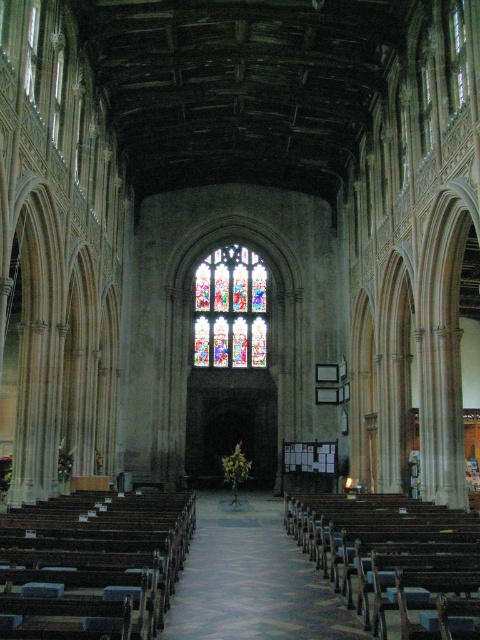
Between point (305, 548) and point (208, 508), which one is positioned behind?

The point (208, 508) is more distant.

In the scene shown: Does wooden polished bench at center appear on the right side of wooden polished pews at center?

Correct, you'll find wooden polished bench at center to the right of wooden polished pews at center.

What do you see at coordinates (395, 560) in the screenshot?
I see `wooden polished bench at center` at bounding box center [395, 560].

Where is `wooden polished bench at center`? The image size is (480, 640). wooden polished bench at center is located at coordinates (395, 560).

Is point (432, 589) positioned behind point (214, 362)?

That is False.

In order to click on wooden polished bench at center in this screenshot , I will do `click(395, 560)`.

Is point (301, 544) positioned in front of point (204, 321)?

Yes, point (301, 544) is closer to viewer.

Where is `wooden polished bench at center`? wooden polished bench at center is located at coordinates (395, 560).

What do you see at coordinates (92, 564) in the screenshot? This screenshot has height=640, width=480. I see `wooden polished bench at lower left` at bounding box center [92, 564].

Does point (152, 561) come farther from viewer compared to point (307, 508)?

No, it is in front of (307, 508).

What are the coordinates of `wooden polished bench at lower left` in the screenshot? It's located at (92, 564).